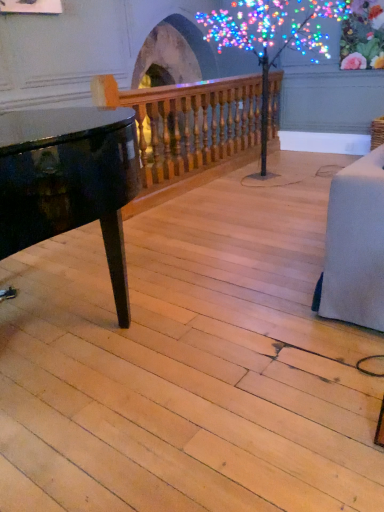
Locate an element on the screen. wooden baluster at upper center is located at coordinates (188, 131).

Describe the element at coordinates (188, 131) in the screenshot. The height and width of the screenshot is (512, 384). I see `wooden baluster at upper center` at that location.

Image resolution: width=384 pixels, height=512 pixels. In order to click on illuminated plastic tree at center in this screenshot , I will do `click(272, 35)`.

The image size is (384, 512). Describe the element at coordinates (272, 35) in the screenshot. I see `illuminated plastic tree at center` at that location.

Find the location of `wooden baluster at upper center`. wooden baluster at upper center is located at coordinates (188, 131).

Considering the relative positions of illuminated plastic tree at center and wooden baluster at upper center in the image provided, is illuminated plastic tree at center to the right of wooden baluster at upper center from the viewer's perspective?

Yes, illuminated plastic tree at center is to the right of wooden baluster at upper center.

Is the depth of illuminated plastic tree at center less than that of wooden baluster at upper center?

Yes, illuminated plastic tree at center is closer to the camera.

Between point (210, 26) and point (161, 155), which one is positioned in front?

Point (161, 155)

From the image's perspective, does illuminated plastic tree at center appear higher than wooden baluster at upper center?

Yes, from the image's perspective, illuminated plastic tree at center is over wooden baluster at upper center.

From a real-world perspective, is illuminated plastic tree at center positioned over wooden baluster at upper center based on gravity?

Yes, from a real-world perspective, illuminated plastic tree at center is on top of wooden baluster at upper center.

Is illuminated plastic tree at center wider than wooden baluster at upper center?

Yes, illuminated plastic tree at center is wider than wooden baluster at upper center.

Is illuminated plastic tree at center shorter than wooden baluster at upper center?

Incorrect, the height of illuminated plastic tree at center does not fall short of that of wooden baluster at upper center.

Which of these two, illuminated plastic tree at center or wooden baluster at upper center, is bigger?

Bigger between the two is illuminated plastic tree at center.

Is wooden baluster at upper center inside illuminated plastic tree at center?

Indeed, wooden baluster at upper center is located within illuminated plastic tree at center.

Is illuminated plastic tree at center not near wooden baluster at upper center?

That's right, there is a large distance between illuminated plastic tree at center and wooden baluster at upper center.

Is illuminated plastic tree at center positioned with its back to wooden baluster at upper center?

Absolutely, illuminated plastic tree at center is directed away from wooden baluster at upper center.

How many degrees apart are the facing directions of illuminated plastic tree at center and wooden baluster at upper center?

0.235 degrees separate the facing orientations of illuminated plastic tree at center and wooden baluster at upper center.

Identify the location of rail lying behind the illuminated plastic tree at center. This screenshot has height=512, width=384. (188, 131).

Is wooden baluster at upper center to the right of illuminated plastic tree at center from the viewer's perspective?

Incorrect, wooden baluster at upper center is not on the right side of illuminated plastic tree at center.

Who is more distant, wooden baluster at upper center or illuminated plastic tree at center?

wooden baluster at upper center is further away from the camera.

Which point is more forward, (219, 84) or (226, 12)?

The point (219, 84) is more forward.

From the image's perspective, who appears lower, wooden baluster at upper center or illuminated plastic tree at center?

wooden baluster at upper center.

From a real-world perspective, which is physically below, wooden baluster at upper center or illuminated plastic tree at center?

wooden baluster at upper center is physically lower.

Does wooden baluster at upper center have a lesser width compared to illuminated plastic tree at center?

Yes.

Can you confirm if wooden baluster at upper center is shorter than illuminated plastic tree at center?

Correct, wooden baluster at upper center is not as tall as illuminated plastic tree at center.

Considering the sizes of objects wooden baluster at upper center and illuminated plastic tree at center in the image provided, who is bigger, wooden baluster at upper center or illuminated plastic tree at center?

illuminated plastic tree at center is bigger.

In the scene shown: Is wooden baluster at upper center surrounding illuminated plastic tree at center?

No, illuminated plastic tree at center is located outside of wooden baluster at upper center.

Is there a large distance between wooden baluster at upper center and illuminated plastic tree at center?

wooden baluster at upper center is positioned a significant distance from illuminated plastic tree at center.

Does wooden baluster at upper center turn towards illuminated plastic tree at center?

Yes, wooden baluster at upper center is oriented towards illuminated plastic tree at center.

How many degrees apart are the facing directions of wooden baluster at upper center and illuminated plastic tree at center?

0.235 degrees.

This screenshot has width=384, height=512. I want to click on tree on the right of wooden baluster at upper center, so click(272, 35).

At what (x,y) coordinates should I click in order to perform the action: click on rail behind the illuminated plastic tree at center. Please return your answer as a coordinate pair (x, y). The width and height of the screenshot is (384, 512). Looking at the image, I should click on (188, 131).

Image resolution: width=384 pixels, height=512 pixels. I want to click on tree that appears in front of the wooden baluster at upper center, so click(x=272, y=35).